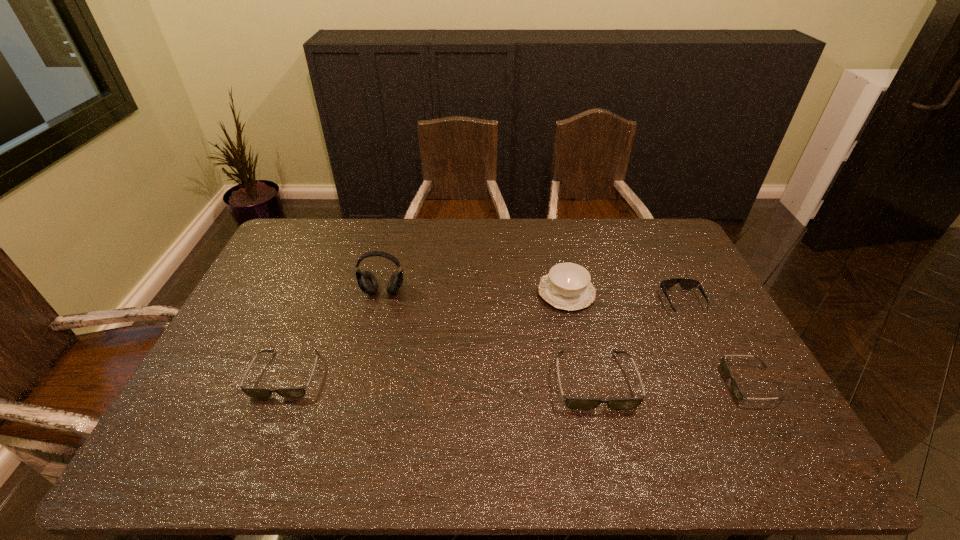
Identify the location of vacant spot for a new sunglasses to ensure equal spacing. This screenshot has height=540, width=960. (440, 377).